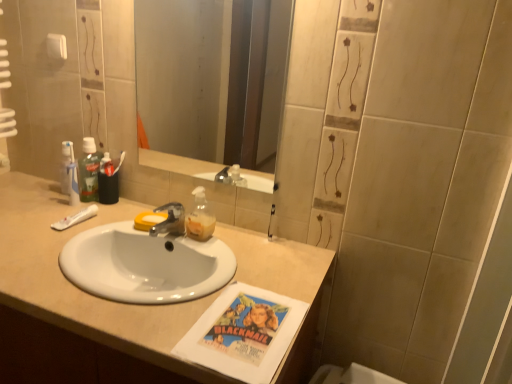
Question: From a real-world perspective, is white glossy sink at center physically located above or below metallic silver faucet at center?

Choices:
 (A) below
 (B) above

Answer: (A)

Question: Is white glossy sink at center taller or shorter than metallic silver faucet at center?

Choices:
 (A) tall
 (B) short

Answer: (A)

Question: Considering the real-world distances, which object is farthest from the translucent plastic soap dispenser at center?

Choices:
 (A) smooth glass mirror at center
 (B) green translucent mouthwash at upper left
 (C) white matte toothpaste at left
 (D) metallic silver faucet at center
 (E) white glossy sink at center

Answer: (A)

Question: Which of these objects is positioned closest to the white matte toothpaste at left?

Choices:
 (A) metallic silver faucet at center
 (B) green translucent mouthwash at upper left
 (C) smooth glass mirror at center
 (D) white glossy sink at center
 (E) translucent plastic soap dispenser at center

Answer: (B)